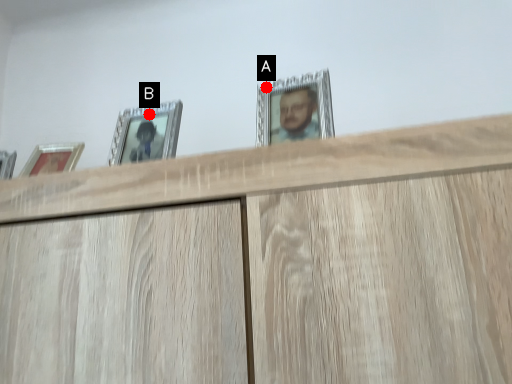
Question: Two points are circled on the image, labeled by A and B beside each circle. Which of the following is the closest to the observer?

Choices:
 (A) A is closer
 (B) B is closer

Answer: (A)